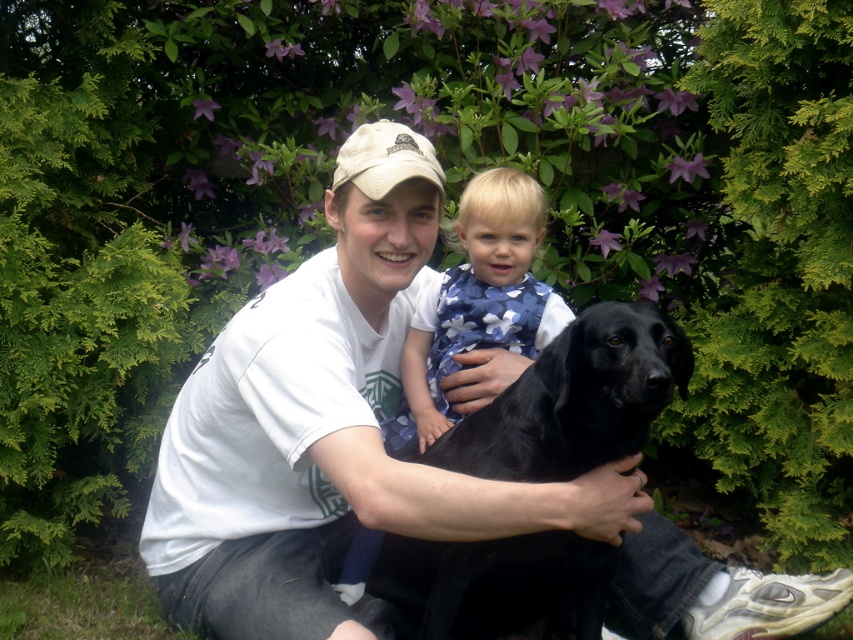
Question: Which point is closer to the camera?

Choices:
 (A) (380, 182)
 (B) (402, 426)
 (C) (634, 404)
 (D) (223, 486)

Answer: (C)

Question: In this image, where is matte black dog at center located relative to beige fabric cap at center?

Choices:
 (A) left
 (B) right

Answer: (A)

Question: Estimate the real-world distances between objects in this image. Which object is farther from the beige fabric cap at center?

Choices:
 (A) matte black dog at center
 (B) shiny black dog at center

Answer: (B)

Question: Is matte black dog at center above beige fabric cap at center?

Choices:
 (A) no
 (B) yes

Answer: (A)

Question: Which point appears closest to the camera in this image?

Choices:
 (A) (520, 480)
 (B) (675, 554)
 (C) (396, 125)
 (D) (434, 294)

Answer: (A)

Question: Can you confirm if shiny black dog at center is bigger than beige fabric cap at center?

Choices:
 (A) no
 (B) yes

Answer: (B)